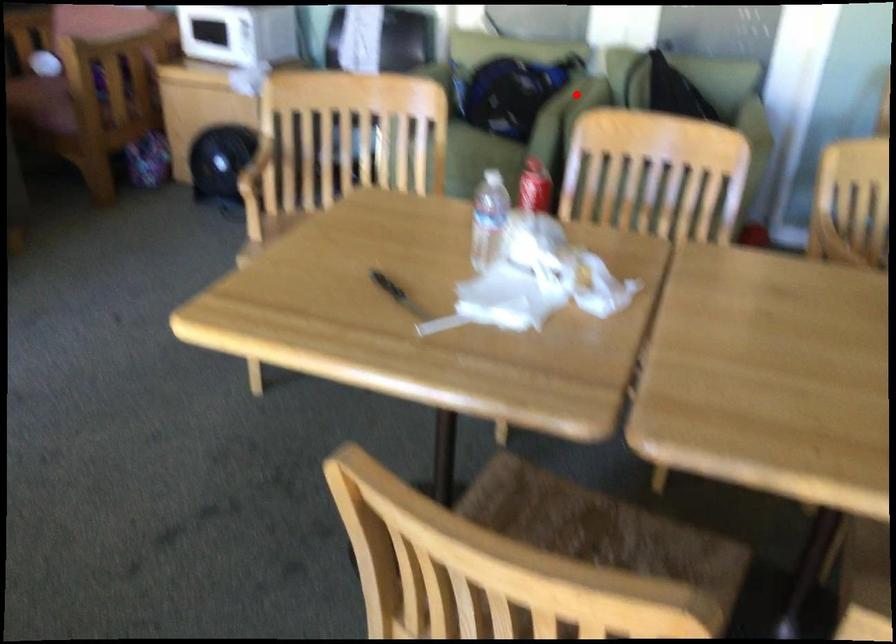
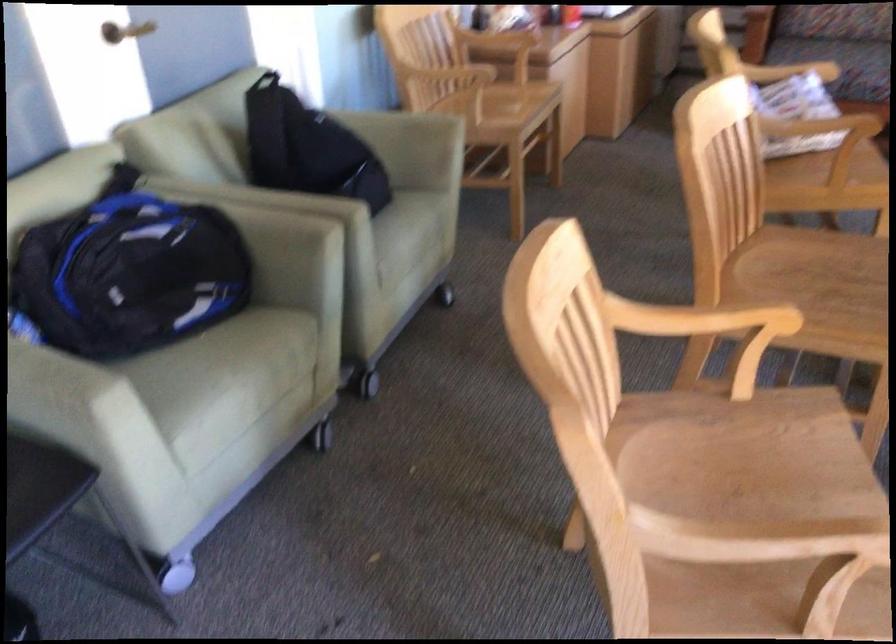
Question: I am providing you with two images of the same scene from different viewpoints. In image1, a red point is highlighted. Considering the same 3D point in image2, which of the following is correct?

Choices:
 (A) It is closer
 (B) It is farther

Answer: (A)